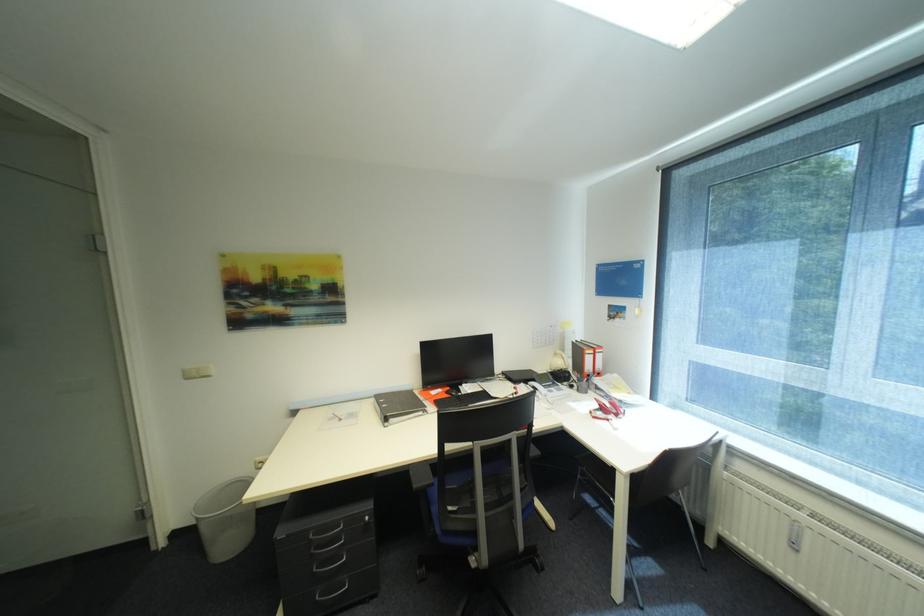
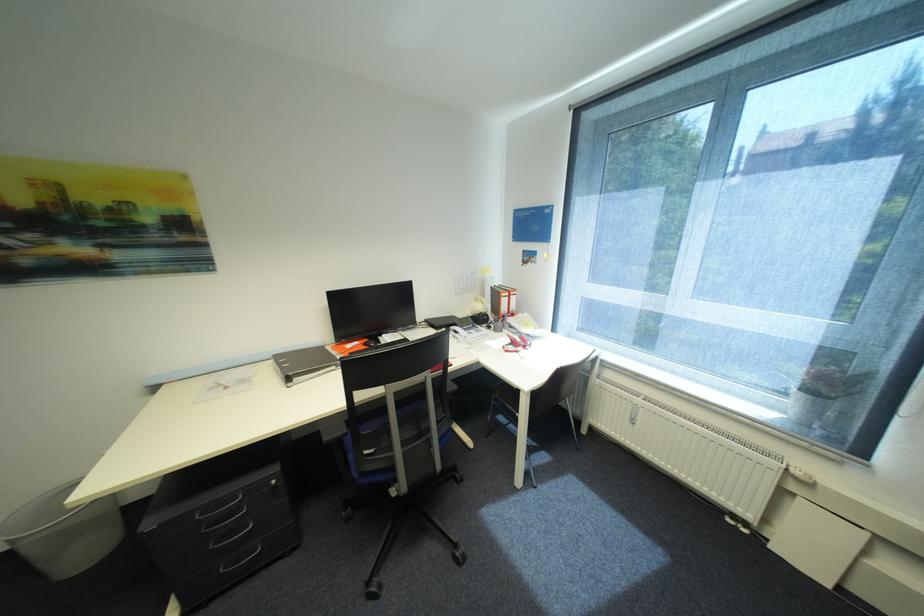
Question: How did the camera likely rotate?

Choices:
 (A) Left
 (B) Right
 (C) Up
 (D) Down

Answer: (B)